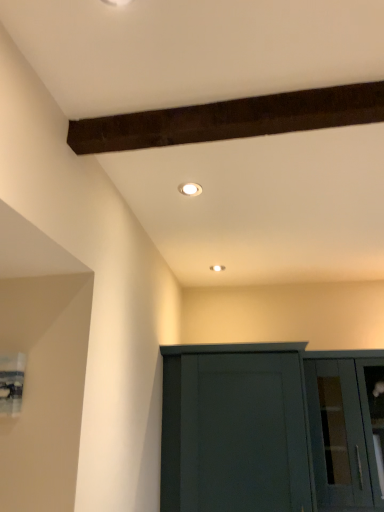
Question: Relative to matte dark green cupboard at lower center, is white glossy light fixture at upper center in front or behind?

Choices:
 (A) front
 (B) behind

Answer: (A)

Question: From a real-world perspective, is white glossy light fixture at upper center physically located above or below matte dark green cupboard at lower center?

Choices:
 (A) above
 (B) below

Answer: (A)

Question: Considering the real-world distances, which object is farthest from the transparent glass cabinet at lower right?

Choices:
 (A) matte dark green cupboard at lower center
 (B) white glossy light fixture at upper center

Answer: (B)

Question: Which object is positioned closest to the white glossy light fixture at upper center?

Choices:
 (A) matte dark green cupboard at lower center
 (B) transparent glass cabinet at lower right

Answer: (A)